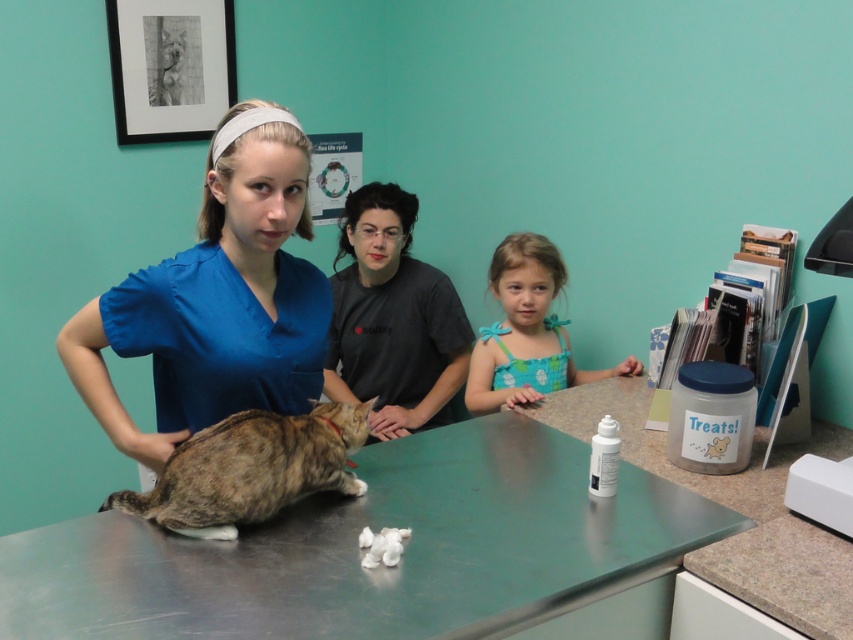
From the picture: Between stainless steel table at center and blue scrubs at center, which one appears on the left side from the viewer's perspective?

blue scrubs at center

From the picture: Can you confirm if stainless steel table at center is taller than blue scrubs at center?

Incorrect, stainless steel table at center's height is not larger of blue scrubs at center's.

Is point (506, 588) positioned before point (248, 362)?

Yes, point (506, 588) is in front of point (248, 362).

Image resolution: width=853 pixels, height=640 pixels. Find the location of `stainless steel table at center`. stainless steel table at center is located at coordinates (380, 566).

Who is more distant from viewer, [453,317] or [204,512]?

The point [453,317] is behind.

Can you confirm if black matte shirt at center is positioned to the right of tabby fur cat at center?

Correct, you'll find black matte shirt at center to the right of tabby fur cat at center.

This screenshot has width=853, height=640. I want to click on black matte shirt at center, so click(392, 317).

The image size is (853, 640). In order to click on black matte shirt at center in this screenshot , I will do `click(392, 317)`.

Is green stainless steel counter top at center shorter than black matte shirt at center?

Yes.

Looking at this image, is green stainless steel counter top at center behind black matte shirt at center?

That is False.

Which is in front, point (724, 588) or point (397, 435)?

Point (724, 588) is more forward.

Where is `green stainless steel counter top at center`? The width and height of the screenshot is (853, 640). green stainless steel counter top at center is located at coordinates (735, 509).